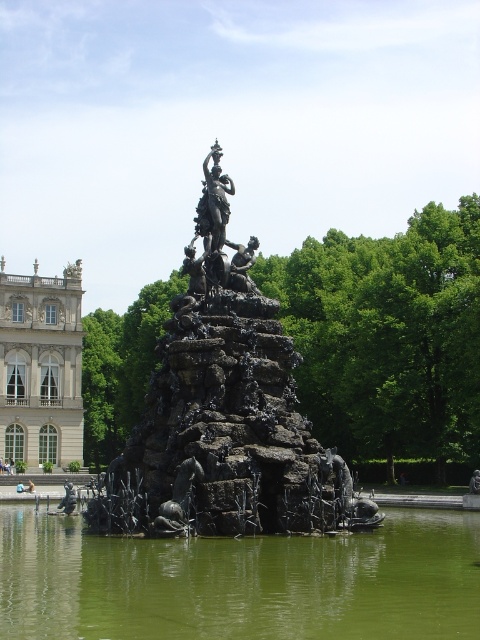
Question: Which point is farther from the camera taking this photo?

Choices:
 (A) (311, 593)
 (B) (210, 186)
 (C) (48, 403)
 (D) (264, 508)

Answer: (C)

Question: Considering the real-world distances, which object is closest to the black metal fountain at center?

Choices:
 (A) green liquid water at center
 (B) bronze statue at center
 (C) polished bronze statue at center
 (D) white marble palace at left

Answer: (B)

Question: Is green liquid water at center closer to the viewer compared to polished bronze statue at center?

Choices:
 (A) no
 (B) yes

Answer: (B)

Question: Which of the following is the farthest from the observer?

Choices:
 (A) (44, 320)
 (B) (420, 634)
 (C) (220, 268)

Answer: (A)

Question: From the image, what is the correct spatial relationship of white marble palace at left in relation to bronze statue at center?

Choices:
 (A) above
 (B) below

Answer: (B)

Question: Is green liquid water at center positioned at the back of bronze statue at center?

Choices:
 (A) yes
 (B) no

Answer: (B)